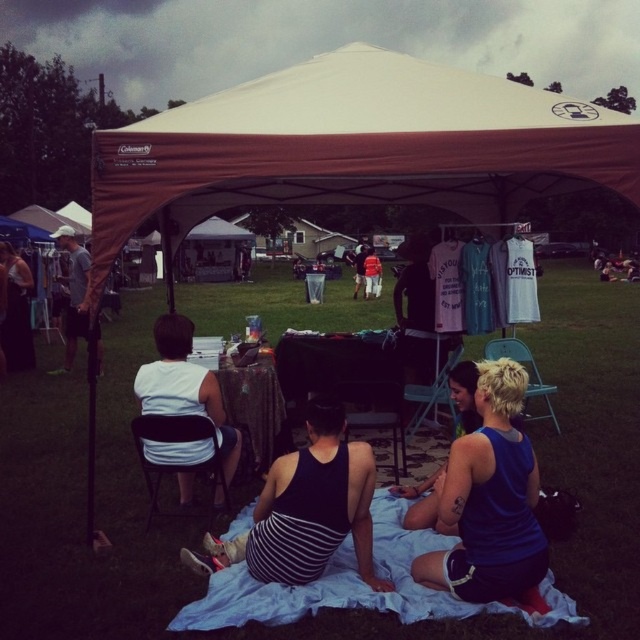
Is white fabric shirt at left smaller than matte white shirt at center?

Yes, white fabric shirt at left is smaller than matte white shirt at center.

Can you confirm if white fabric shirt at left is positioned above matte white shirt at center?

No.

Is point (177, 362) positioned before point (364, 262)?

Yes, it is.

Where is `white fabric shirt at left`? white fabric shirt at left is located at coordinates (184, 387).

Between blue fabric tank top at lower right and white fabric shirt at left, which one is positioned higher?

white fabric shirt at left

Is blue fabric tank top at lower right closer to camera compared to white fabric shirt at left?

Yes, blue fabric tank top at lower right is in front of white fabric shirt at left.

Which is behind, point (438, 497) or point (177, 445)?

The point (177, 445) is behind.

Locate an element on the screen. This screenshot has height=640, width=640. blue fabric tank top at lower right is located at coordinates (490, 499).

Is point (193, 388) behind point (99, 365)?

No, (193, 388) is in front of (99, 365).

Can you confirm if white fabric shirt at left is positioned below matte gray shirt at left?

Yes.

Is point (227, 467) closer to camera compared to point (68, 340)?

Yes, point (227, 467) is closer to viewer.

At what (x,y) coordinates should I click in order to perform the action: click on white fabric shirt at left. Please return your answer as a coordinate pair (x, y). The height and width of the screenshot is (640, 640). Looking at the image, I should click on (184, 387).